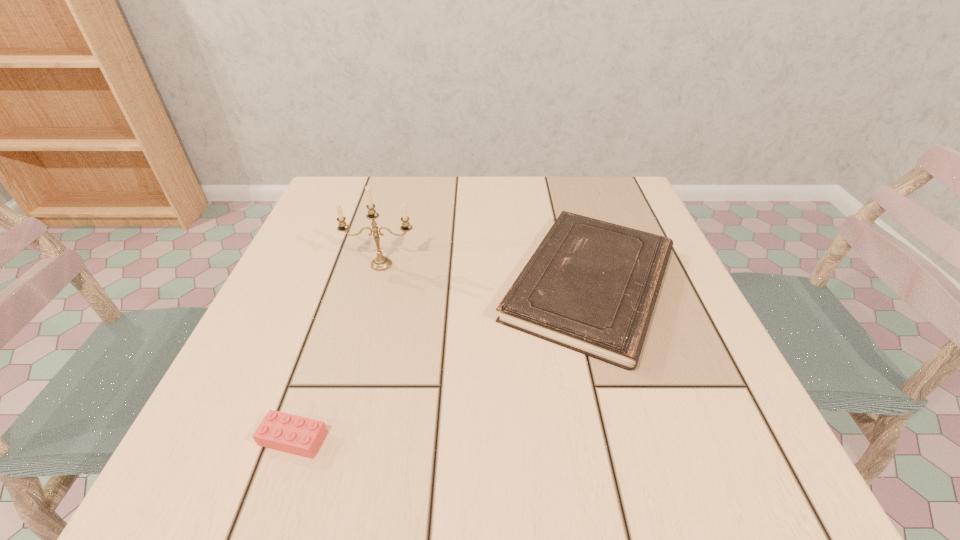
Find the location of `vacant space at the near right corner of the desktop`. vacant space at the near right corner of the desktop is located at coordinates (744, 464).

Where is `vacant region between the Lego and the tallest object`? vacant region between the Lego and the tallest object is located at coordinates (337, 352).

You are a GUI agent. You are given a task and a screenshot of the screen. Output one action in this format:
    pyautogui.click(x=<x>, y=<y>)
    Task: Click on the vacant region between the tallest object and the paperback book
    
    Given the screenshot: What is the action you would take?
    pyautogui.click(x=486, y=274)

Find the location of a particular element. vacant area that lies between the tallest object and the rightmost object is located at coordinates (486, 274).

Where is `vacant area that lies between the paperback book and the Lego`? The height and width of the screenshot is (540, 960). vacant area that lies between the paperback book and the Lego is located at coordinates (442, 361).

Where is `unoccupied area between the rightmost object and the tallest object`? This screenshot has width=960, height=540. unoccupied area between the rightmost object and the tallest object is located at coordinates (486, 274).

Where is `vacant space in between the paperback book and the tallest object`? This screenshot has height=540, width=960. vacant space in between the paperback book and the tallest object is located at coordinates (486, 274).

Identify the location of free point between the shortest object and the rightmost object. (442, 361).

Image resolution: width=960 pixels, height=540 pixels. I want to click on free space between the Lego and the candle, so click(x=337, y=352).

This screenshot has width=960, height=540. I want to click on empty space between the rightmost object and the tallest object, so click(486, 274).